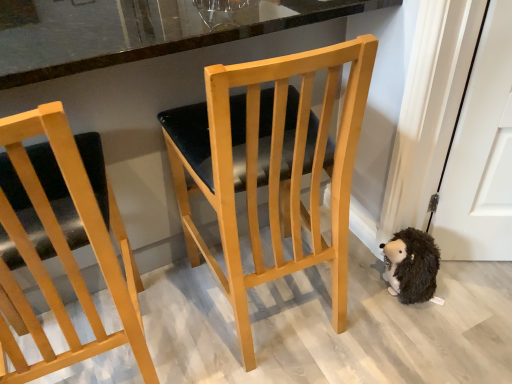
Question: Can you confirm if black fuzzy stuffed animal at lower right is smaller than light wood chair at center, arranged as the 2th chair when viewed from the left?

Choices:
 (A) no
 (B) yes

Answer: (B)

Question: Is black fuzzy stuffed animal at lower right aimed at light wood chair at center, acting as the first chair starting from the right?

Choices:
 (A) yes
 (B) no

Answer: (A)

Question: From the image's perspective, is black fuzzy stuffed animal at lower right below light wood chair at center, acting as the first chair starting from the right?

Choices:
 (A) no
 (B) yes

Answer: (B)

Question: Considering the relative positions of black fuzzy stuffed animal at lower right and light wood chair at center, acting as the first chair starting from the right, in the image provided, is black fuzzy stuffed animal at lower right to the left of light wood chair at center, acting as the first chair starting from the right, from the viewer's perspective?

Choices:
 (A) no
 (B) yes

Answer: (A)

Question: Is black fuzzy stuffed animal at lower right not close to light wood chair at center, arranged as the 2th chair when viewed from the left?

Choices:
 (A) yes
 (B) no

Answer: (B)

Question: Is black fuzzy stuffed animal at lower right taller or shorter than light wood chair at center, arranged as the 2th chair when viewed from the left?

Choices:
 (A) short
 (B) tall

Answer: (A)

Question: Relative to light wood chair at center, acting as the first chair starting from the right, is black fuzzy stuffed animal at lower right in front or behind?

Choices:
 (A) front
 (B) behind

Answer: (B)

Question: From the image's perspective, is black fuzzy stuffed animal at lower right located above or below light wood chair at center, arranged as the 2th chair when viewed from the left?

Choices:
 (A) below
 (B) above

Answer: (A)

Question: Would you say black fuzzy stuffed animal at lower right is inside or outside light wood chair at center, acting as the first chair starting from the right?

Choices:
 (A) outside
 (B) inside

Answer: (A)

Question: In terms of height, does black fuzzy stuffed animal at lower right look taller or shorter compared to light wood chair at left, placed as the second chair when sorted from right to left?

Choices:
 (A) tall
 (B) short

Answer: (B)

Question: Considering the positions of black fuzzy stuffed animal at lower right and light wood chair at left, placed as the second chair when sorted from right to left, in the image, is black fuzzy stuffed animal at lower right bigger or smaller than light wood chair at left, placed as the second chair when sorted from right to left,?

Choices:
 (A) small
 (B) big

Answer: (A)

Question: From the image's perspective, is black fuzzy stuffed animal at lower right positioned above or below light wood chair at left, placed as the second chair when sorted from right to left?

Choices:
 (A) below
 (B) above

Answer: (A)

Question: Considering the positions of black fuzzy stuffed animal at lower right and light wood chair at left, placed as the second chair when sorted from right to left, in the image, is black fuzzy stuffed animal at lower right wider or thinner than light wood chair at left, placed as the second chair when sorted from right to left,?

Choices:
 (A) wide
 (B) thin

Answer: (B)

Question: Relative to light wood chair at center, arranged as the 2th chair when viewed from the left, is light wood chair at left, which appears as the first chair when viewed from the left, in front or behind?

Choices:
 (A) front
 (B) behind

Answer: (A)

Question: Is light wood chair at left, placed as the second chair when sorted from right to left, to the left or to the right of light wood chair at center, arranged as the 2th chair when viewed from the left, in the image?

Choices:
 (A) right
 (B) left

Answer: (B)